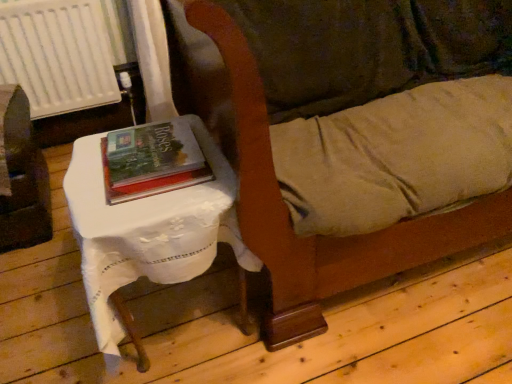
I want to click on free spot to the left of hardcover book at center, so [x=84, y=167].